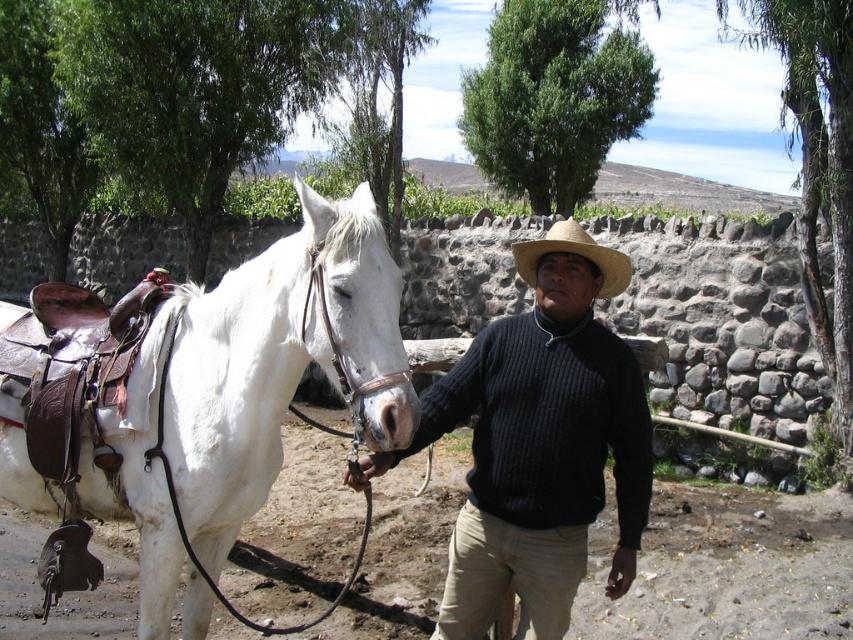
Question: Is knitted dark blue sweater at center behind straw hat at center?

Choices:
 (A) no
 (B) yes

Answer: (A)

Question: Is white leather saddle at left in front of straw hat at center?

Choices:
 (A) no
 (B) yes

Answer: (B)

Question: Which point appears farthest from the camera in this image?

Choices:
 (A) (x=479, y=445)
 (B) (x=578, y=228)
 (C) (x=86, y=413)

Answer: (C)

Question: Can you confirm if knitted dark blue sweater at center is smaller than straw hat at center?

Choices:
 (A) no
 (B) yes

Answer: (A)

Question: Estimate the real-world distances between objects in this image. Which object is farther from the straw hat at center?

Choices:
 (A) knitted dark blue sweater at center
 (B) white leather saddle at left

Answer: (B)

Question: Based on their relative distances, which object is farther from the knitted dark blue sweater at center?

Choices:
 (A) white leather saddle at left
 (B) straw hat at center

Answer: (A)